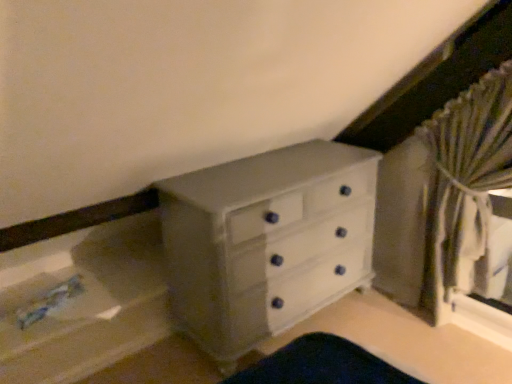
Where is `unoccupied region to the right of white painted wood chest of drawers at center`? The height and width of the screenshot is (384, 512). unoccupied region to the right of white painted wood chest of drawers at center is located at coordinates (404, 337).